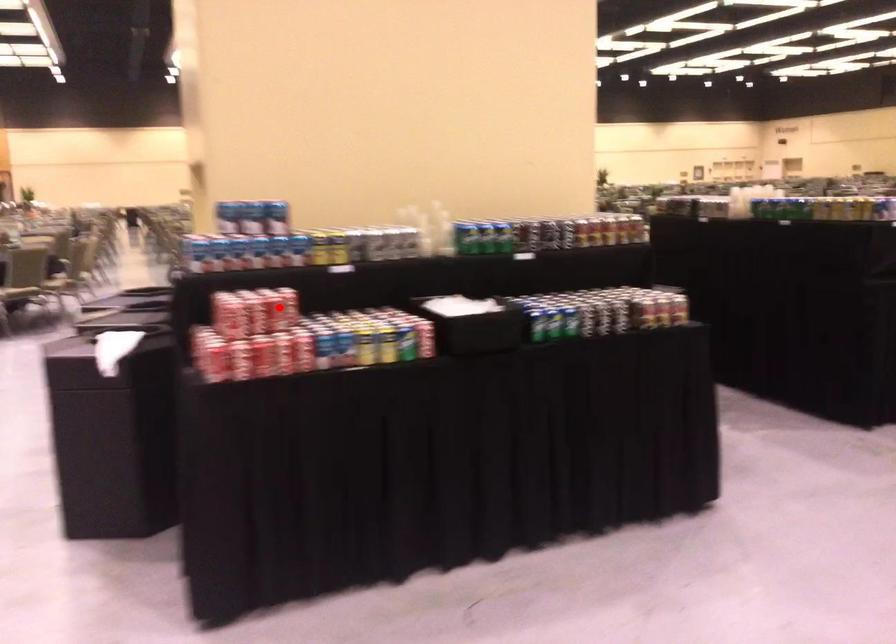
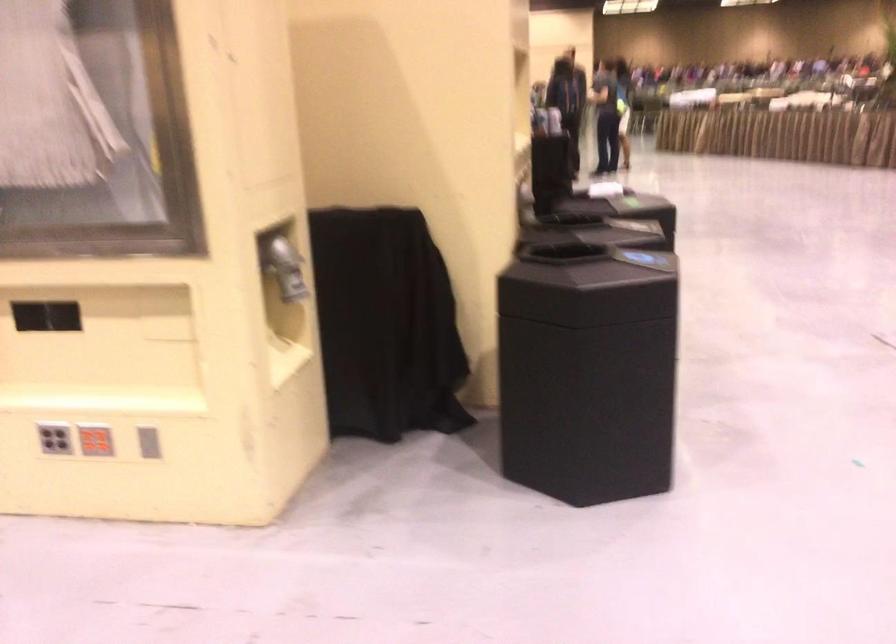
Question: I am providing you with two images of the same scene from different viewpoints. A red point is marked on the first image. Is the red point's position out of view in image 2?

Choices:
 (A) Yes
 (B) No

Answer: (A)